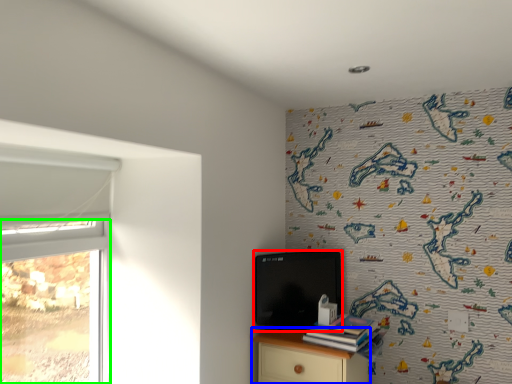
Question: Estimate the real-world distances between objects in this image. Which object is closer to computer (highlighted by a red box), nightstand (highlighted by a blue box) or window (highlighted by a green box)?

Choices:
 (A) nightstand
 (B) window

Answer: (A)